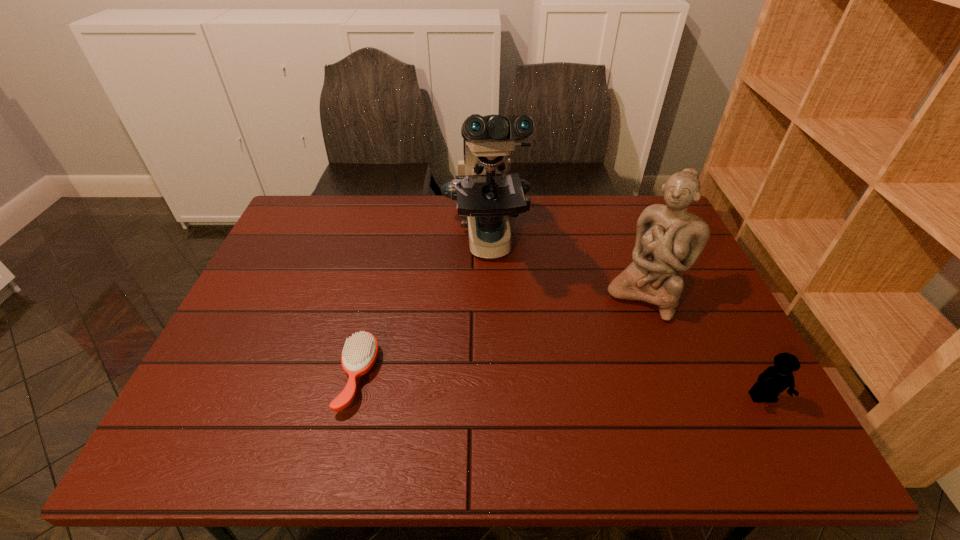
Identify the location of free spot located 0.130m on the front-facing side of the third shortest object. (608, 350).

Identify the location of free space located 0.240m on the front-facing side of the third shortest object. The image size is (960, 540). (588, 382).

Locate an element on the screen. vacant space located 0.200m through the eyepieces of the microscope is located at coordinates (498, 348).

Where is `vacant space situated through the eyepieces of the microscope`? This screenshot has width=960, height=540. vacant space situated through the eyepieces of the microscope is located at coordinates (492, 303).

Where is `free space located 0.300m through the eyepieces of the microscope`? free space located 0.300m through the eyepieces of the microscope is located at coordinates (503, 383).

Where is `object present at the far edge`? The height and width of the screenshot is (540, 960). object present at the far edge is located at coordinates (485, 191).

Find the location of a particular element. hairbrush positioned at the near edge is located at coordinates (359, 354).

Where is `Lego present at the near edge`? This screenshot has height=540, width=960. Lego present at the near edge is located at coordinates (775, 379).

Identify the location of Lego at the right edge. (775, 379).

Where is `figurine located at the right edge`? The height and width of the screenshot is (540, 960). figurine located at the right edge is located at coordinates (669, 240).